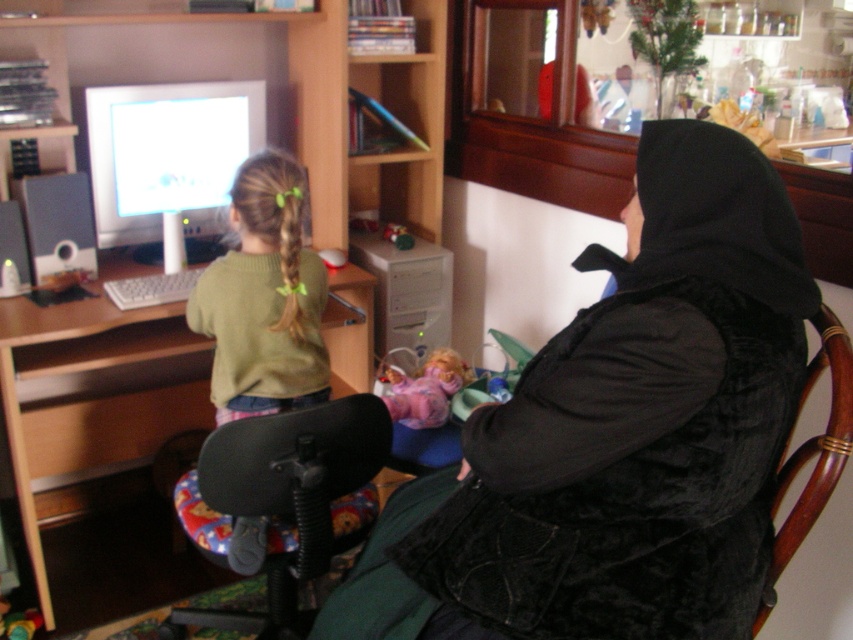
Question: Can you confirm if white glossy computer monitor at upper left is positioned to the right of green braided hair at center?

Choices:
 (A) yes
 (B) no

Answer: (B)

Question: Which object is positioned farthest from the green sweater at left?

Choices:
 (A) white glossy computer monitor at upper left
 (B) black velvet vest at center
 (C) wooden chair at right

Answer: (C)

Question: Does black plastic swivel chair at lower left appear under green braided hair at center?

Choices:
 (A) yes
 (B) no

Answer: (A)

Question: Does wooden desk at lower left have a larger size compared to white glossy computer monitor at upper left?

Choices:
 (A) yes
 (B) no

Answer: (A)

Question: Which of the following is the farthest from the observer?

Choices:
 (A) white glossy computer monitor at upper left
 (B) black plastic swivel chair at lower left
 (C) green sweater at left
 (D) wooden chair at right

Answer: (A)

Question: Which of the following is the closest to the observer?

Choices:
 (A) (91, 177)
 (B) (149, 362)
 (C) (297, 228)

Answer: (C)